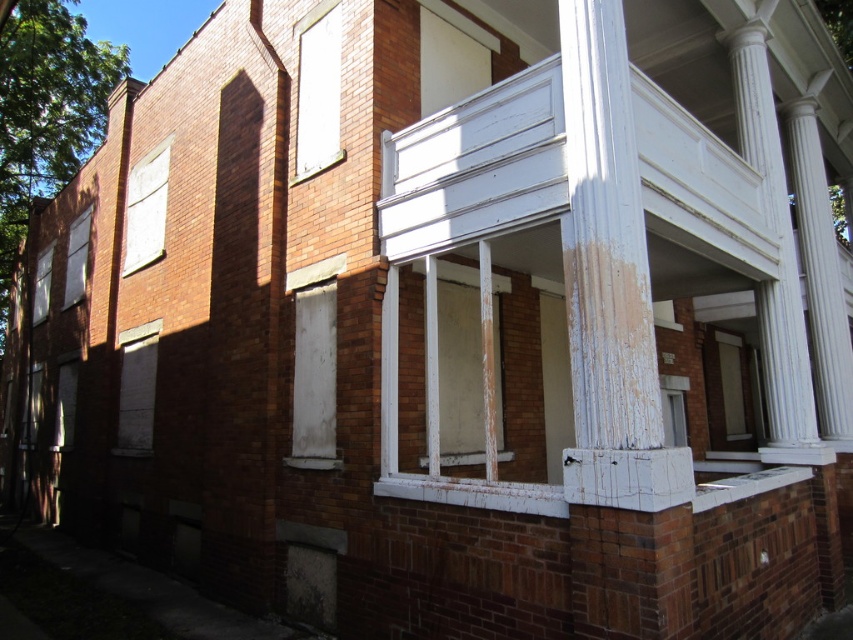
You are a contractor assessing the building for repairs. You notice the white painted wood window at center and the white matte sign at upper left. Which object requires more attention due to its larger size and potential structural impact?

The white matte sign at upper left requires more attention due to its larger size compared to the white painted wood window at center, which may pose greater structural concerns.

You are standing in front of the brick building and want to know which of the two points, point [469,436] or point [166,177], is nearer to you. Can you determine this based on the image?

Point [469,436] is closer to the viewer than point [166,177].